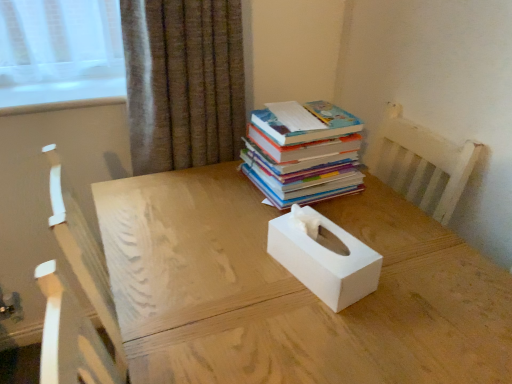
Question: From a real-world perspective, is white matte tissue box at center under white matte tissue box at center?

Choices:
 (A) no
 (B) yes

Answer: (A)

Question: Is white matte tissue box at center shorter than white matte tissue box at center?

Choices:
 (A) yes
 (B) no

Answer: (A)

Question: Is white matte tissue box at center located within white matte tissue box at center?

Choices:
 (A) yes
 (B) no

Answer: (B)

Question: Is white matte tissue box at center positioned far away from white matte tissue box at center?

Choices:
 (A) yes
 (B) no

Answer: (B)

Question: Would you say white matte tissue box at center is outside white matte tissue box at center?

Choices:
 (A) yes
 (B) no

Answer: (A)

Question: Is the depth of white matte tissue box at center greater than that of white matte tissue box at center?

Choices:
 (A) yes
 (B) no

Answer: (A)

Question: From the image's perspective, would you say white matte tissue box at center is positioned over hardcover books at upper right?

Choices:
 (A) no
 (B) yes

Answer: (A)

Question: Is white matte tissue box at center positioned with its back to hardcover books at upper right?

Choices:
 (A) yes
 (B) no

Answer: (B)

Question: Can you confirm if white matte tissue box at center is thinner than hardcover books at upper right?

Choices:
 (A) yes
 (B) no

Answer: (A)

Question: Is white matte tissue box at center positioned far away from hardcover books at upper right?

Choices:
 (A) no
 (B) yes

Answer: (A)

Question: Is white matte tissue box at center to the right of hardcover books at upper right from the viewer's perspective?

Choices:
 (A) yes
 (B) no

Answer: (A)

Question: Does white matte tissue box at center lie in front of hardcover books at upper right?

Choices:
 (A) no
 (B) yes

Answer: (B)

Question: Is white matte tissue box at center next to brown textured curtain at upper center?

Choices:
 (A) yes
 (B) no

Answer: (B)